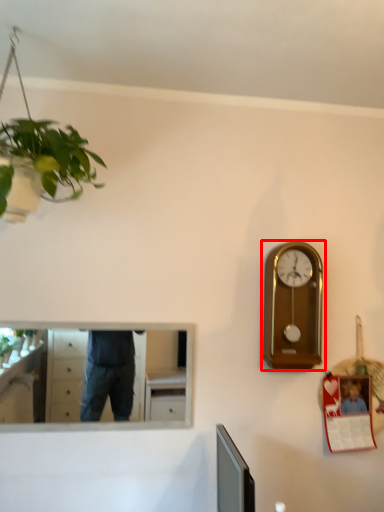
Question: Where is wall clock (annotated by the red box) located in relation to mirror in the image?

Choices:
 (A) left
 (B) right

Answer: (B)